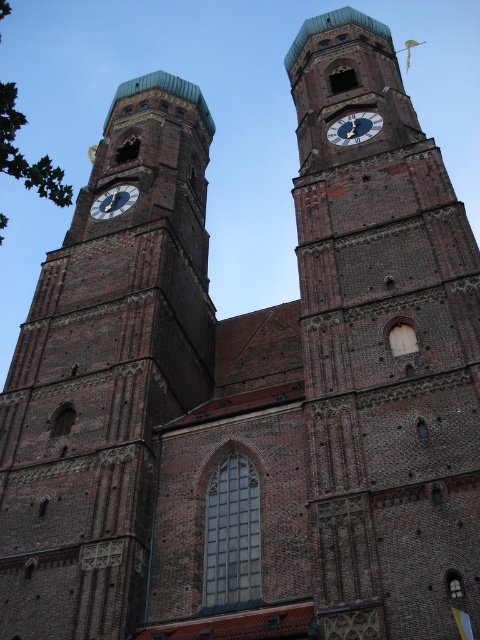
Question: Considering the real-world distances, which object is closest to the gold metallic clock at left?

Choices:
 (A) brown brick clock tower at center
 (B) gold metallic clock at upper center
 (C) brown brick clock tower at left

Answer: (C)

Question: In this image, where is brown brick clock tower at left located relative to gold metallic clock at left?

Choices:
 (A) below
 (B) above

Answer: (A)

Question: Which object is farther from the camera taking this photo?

Choices:
 (A) gold metallic clock at upper center
 (B) brown brick clock tower at left
 (C) brown brick clock tower at center
 (D) gold metallic clock at left

Answer: (D)

Question: Is brown brick clock tower at center further to the viewer compared to brown brick clock tower at left?

Choices:
 (A) no
 (B) yes

Answer: (A)

Question: Which point is farther from the camera taking this photo?

Choices:
 (A) (126, 198)
 (B) (354, 337)
 (C) (352, 144)
 (D) (173, 180)

Answer: (D)

Question: Observing the image, what is the correct spatial positioning of brown brick clock tower at center in reference to gold metallic clock at upper center?

Choices:
 (A) right
 (B) left

Answer: (A)